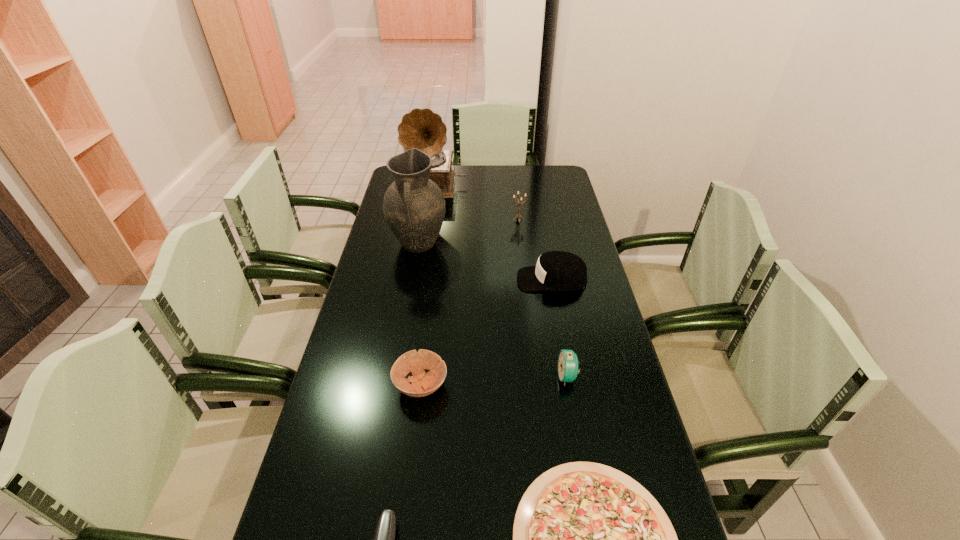
Locate an element on the screen. This screenshot has width=960, height=540. free space located on the front-facing side of the fourth farthest object is located at coordinates (404, 280).

At what (x,y) coordinates should I click in order to perform the action: click on free space located 0.400m on the front-facing side of the fourth farthest object. Please return your answer as a coordinate pair (x, y). This screenshot has width=960, height=540. Looking at the image, I should click on (398, 280).

The image size is (960, 540). Identify the location of blank space located on the front-facing side of the fourth farthest object. (461, 280).

At what (x,y) coordinates should I click in order to perform the action: click on free space located on the front-facing side of the alarm clock. Please return your answer as a coordinate pair (x, y). Looking at the image, I should click on (480, 376).

Locate an element on the screen. Image resolution: width=960 pixels, height=540 pixels. vacant space located 0.400m on the front-facing side of the alarm clock is located at coordinates (409, 376).

The width and height of the screenshot is (960, 540). I want to click on free space located 0.180m on the front-facing side of the alarm clock, so click(491, 376).

Where is `free point located 0.120m on the right of the bowl`? This screenshot has height=540, width=960. free point located 0.120m on the right of the bowl is located at coordinates (493, 385).

This screenshot has width=960, height=540. Find the location of `object that is at the far edge`. object that is at the far edge is located at coordinates (422, 129).

What are the coordinates of `record player that is at the left edge` in the screenshot? It's located at (422, 129).

Locate an element on the screen. The width and height of the screenshot is (960, 540). pitcher situated at the left edge is located at coordinates (414, 207).